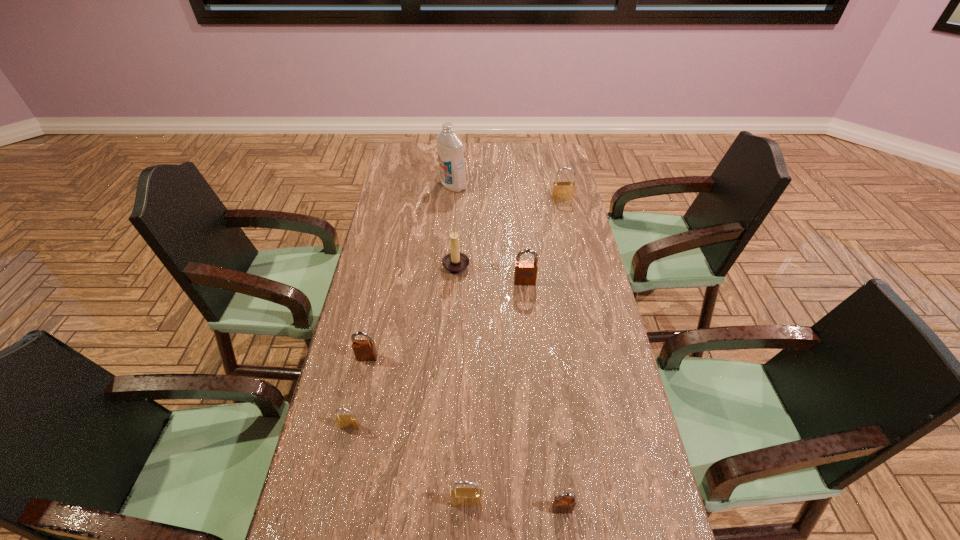
Locate an element on the screen. The image size is (960, 540). free space between the second farthest brown padlock and the nearest brown padlock is located at coordinates (465, 433).

This screenshot has height=540, width=960. Find the location of `free space that is in between the farthest padlock and the farthest object`. free space that is in between the farthest padlock and the farthest object is located at coordinates (508, 192).

Where is `vacant space that's between the fifth nearest padlock and the second farthest brown padlock`? Image resolution: width=960 pixels, height=540 pixels. vacant space that's between the fifth nearest padlock and the second farthest brown padlock is located at coordinates (446, 320).

Locate an element on the screen. The height and width of the screenshot is (540, 960). vacant space in between the sixth nearest object and the smallest brown padlock is located at coordinates (510, 387).

You are a GUI agent. You are given a task and a screenshot of the screen. Output one action in this format:
    pyautogui.click(x=<x>, y=<y>)
    Task: Click on the vacant area that lies between the second farthest brass padlock and the farthest brass padlock
    
    Given the screenshot: What is the action you would take?
    pyautogui.click(x=455, y=312)

The image size is (960, 540). In order to click on object identified as the third closest to the fourth nearest object in this screenshot , I will do `click(460, 497)`.

Identify the location of the fourth closest object relative to the smallest brass padlock. This screenshot has height=540, width=960. (455, 262).

Select which padlock is the third closest to the second smallest brown padlock. Please provide its 2D coordinates. Your answer should be formatted as a tuple, i.e. [(x, y)], where the tuple contains the x and y coordinates of a point satisfying the conditions above.

[(525, 273)]

Identify which padlock is located as the second nearest to the second smallest brass padlock. Please provide its 2D coordinates. Your answer should be formatted as a tuple, i.e. [(x, y)], where the tuple contains the x and y coordinates of a point satisfying the conditions above.

[(343, 421)]

Find the location of a particular element. brass padlock that stands as the second closest to the third farthest padlock is located at coordinates (460, 497).